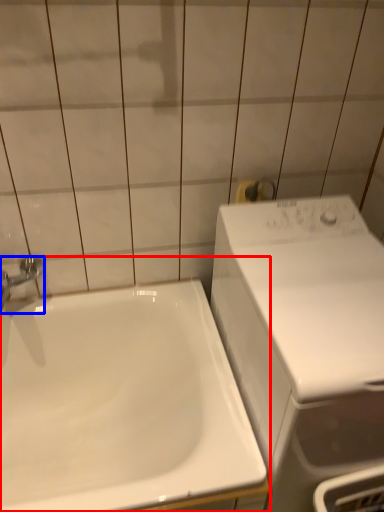
Question: Which object is further to the camera taking this photo, sink (highlighted by a red box) or tap (highlighted by a blue box)?

Choices:
 (A) sink
 (B) tap

Answer: (B)